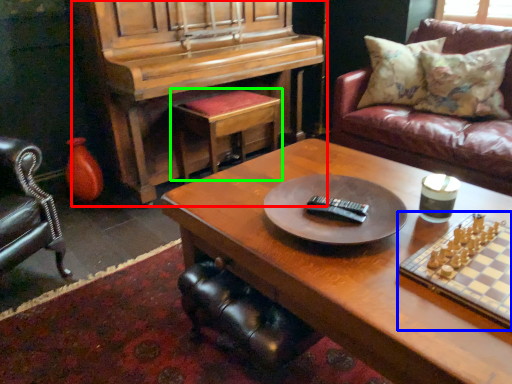
Question: Based on their relative distances, which object is nearer to piano (highlighted by a red box)? Choose from board game (highlighted by a blue box) and stool (highlighted by a green box).

Choices:
 (A) board game
 (B) stool

Answer: (B)